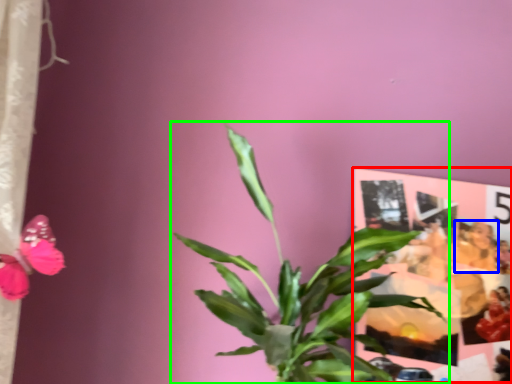
Question: Which object is positioned farthest from postcard (highlighted by a red box)? Select from person (highlighted by a blue box) and houseplant (highlighted by a green box).

Choices:
 (A) person
 (B) houseplant

Answer: (B)